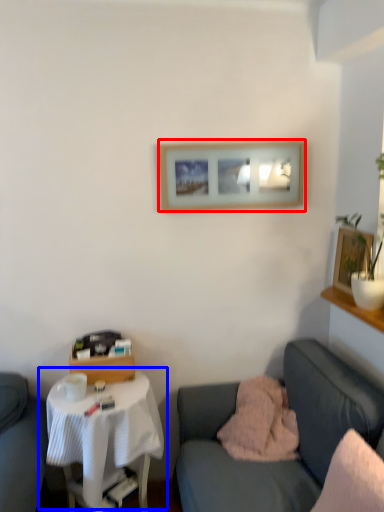
Question: Which object appears closest to the camera in this image, picture frame (highlighted by a red box) or table (highlighted by a blue box)?

Choices:
 (A) picture frame
 (B) table

Answer: (B)